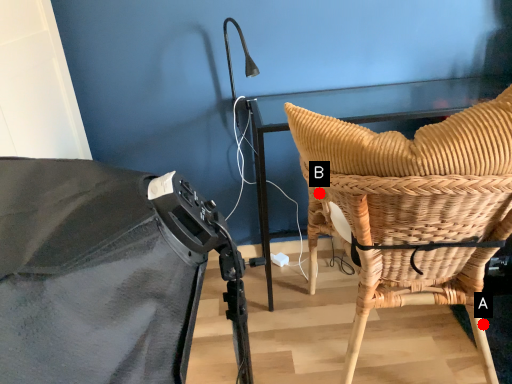
Question: Two points are circled on the image, labeled by A and B beside each circle. Which point is farther to the camera?

Choices:
 (A) A is further
 (B) B is further

Answer: (B)